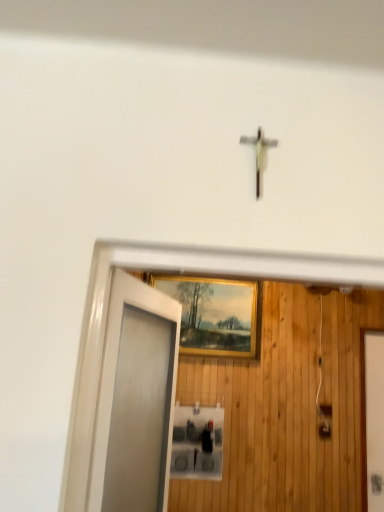
Question: Is frosted glass door at left a part of white glossy elevator door at right?

Choices:
 (A) no
 (B) yes

Answer: (A)

Question: From the image's perspective, is white glossy elevator door at right beneath frosted glass door at left?

Choices:
 (A) no
 (B) yes

Answer: (B)

Question: Can you confirm if white glossy elevator door at right is taller than frosted glass door at left?

Choices:
 (A) yes
 (B) no

Answer: (A)

Question: Does white glossy elevator door at right come behind frosted glass door at left?

Choices:
 (A) no
 (B) yes

Answer: (B)

Question: Can you confirm if white glossy elevator door at right is smaller than frosted glass door at left?

Choices:
 (A) no
 (B) yes

Answer: (B)

Question: From a real-world perspective, is white glossy elevator door at right located higher than frosted glass door at left?

Choices:
 (A) no
 (B) yes

Answer: (A)

Question: Can you confirm if gold-framed painting at center is thinner than frosted glass door at left?

Choices:
 (A) no
 (B) yes

Answer: (B)

Question: Can you confirm if gold-framed painting at center is wider than frosted glass door at left?

Choices:
 (A) no
 (B) yes

Answer: (A)

Question: From a real-world perspective, is gold-framed painting at center over frosted glass door at left?

Choices:
 (A) no
 (B) yes

Answer: (B)

Question: Is gold-framed painting at center next to frosted glass door at left?

Choices:
 (A) yes
 (B) no

Answer: (B)

Question: From the image's perspective, is gold-framed painting at center on frosted glass door at left?

Choices:
 (A) yes
 (B) no

Answer: (A)

Question: Can you confirm if gold-framed painting at center is positioned to the right of frosted glass door at left?

Choices:
 (A) yes
 (B) no

Answer: (A)

Question: Is frosted glass door at left shorter than gold-framed painting at center?

Choices:
 (A) no
 (B) yes

Answer: (A)